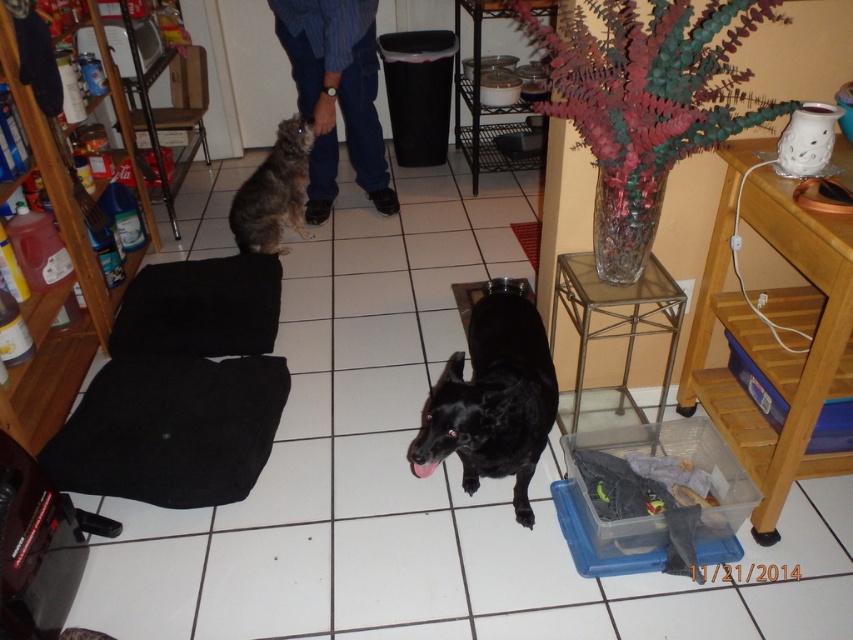
Can you confirm if black matte dog at center is positioned above fuzzy brown cat at upper left?

No, black matte dog at center is not above fuzzy brown cat at upper left.

Which is below, black matte dog at center or fuzzy brown cat at upper left?

Positioned lower is black matte dog at center.

This screenshot has width=853, height=640. In order to click on black matte dog at center in this screenshot , I will do `click(492, 401)`.

Find the location of a particular element. black matte dog at center is located at coordinates (492, 401).

Is black matte dog at center to the right of gold metallic stool at center from the viewer's perspective?

No, black matte dog at center is not to the right of gold metallic stool at center.

Can you confirm if black matte dog at center is positioned to the left of gold metallic stool at center?

Yes, black matte dog at center is to the left of gold metallic stool at center.

This screenshot has height=640, width=853. Identify the location of black matte dog at center. (492, 401).

Is gold metallic stool at center closer to the viewer compared to fuzzy brown cat at upper left?

Yes.

Can you confirm if gold metallic stool at center is positioned to the right of fuzzy brown cat at upper left?

Yes, gold metallic stool at center is to the right of fuzzy brown cat at upper left.

Locate an element on the screen. gold metallic stool at center is located at coordinates [x=612, y=333].